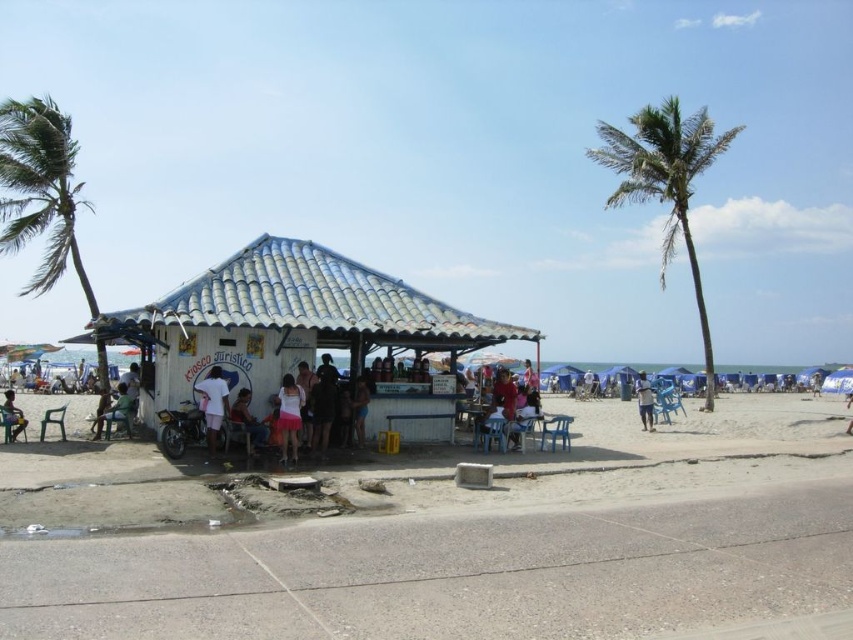
Is point (689, 602) farther from camera compared to point (637, 396)?

No, (689, 602) is closer to viewer.

Is beige concrete beach at center closer to camera compared to blue fabric shorts at lower right?

Yes, it is.

Where is `beige concrete beach at center`? This screenshot has width=853, height=640. beige concrete beach at center is located at coordinates (492, 548).

How far apart are matte red shirt at center and matte black shirt at center?

They are 4.98 meters apart.

Between point (511, 410) and point (238, 408), which one is positioned in front?

Point (238, 408) is in front.

At what (x,y) coordinates should I click in order to perform the action: click on matte red shirt at center. Please return your answer as a coordinate pair (x, y). The image size is (853, 640). Looking at the image, I should click on (503, 396).

Who is positioned more to the right, green leafy palm tree at left or matte black shirt at lower left?

From the viewer's perspective, matte black shirt at lower left appears more on the right side.

Where is `green leafy palm tree at left`? The image size is (853, 640). green leafy palm tree at left is located at coordinates (39, 189).